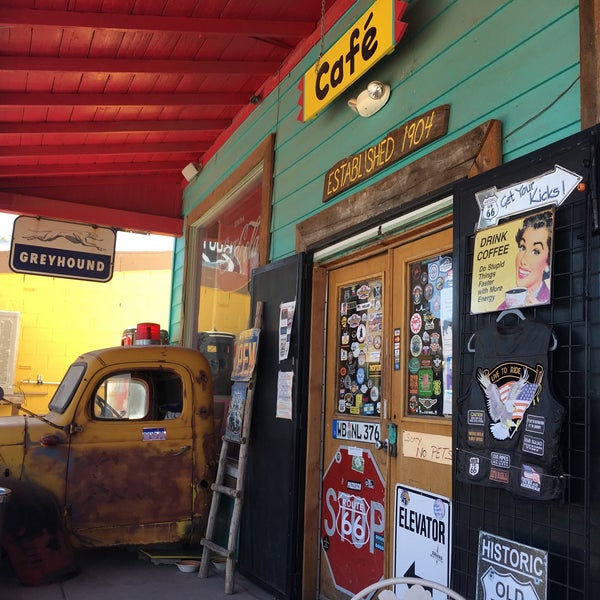
The width and height of the screenshot is (600, 600). What are the coordinates of `ladder` in the screenshot? It's located at (214, 552).